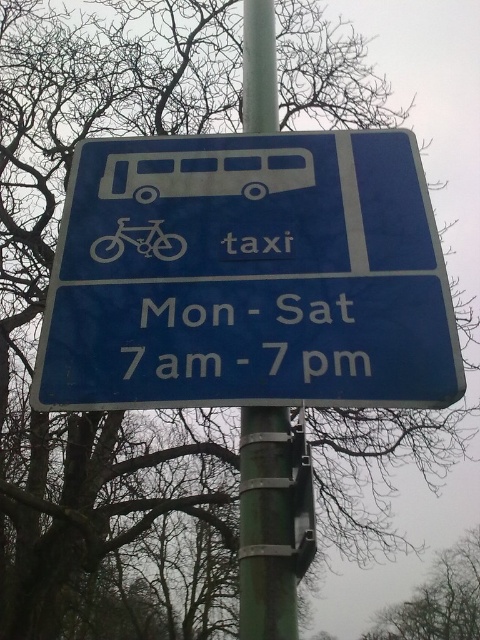
Question: Is blue plastic sign at center in front of white text at center?

Choices:
 (A) no
 (B) yes

Answer: (B)

Question: Among these points, which one is nearest to the camera?

Choices:
 (A) (126, 243)
 (B) (368, 360)

Answer: (B)

Question: Which object is closer to the camera taking this photo?

Choices:
 (A) green metallic pole at center
 (B) blue plastic sign at center
 (C) white text at center
 (D) matte silver bicycle at center

Answer: (B)

Question: Which point is closer to the camera?

Choices:
 (A) (187, 308)
 (B) (263, 557)

Answer: (B)

Question: Can you confirm if white text at center is bigger than matte silver bicycle at center?

Choices:
 (A) no
 (B) yes

Answer: (B)

Question: From the image, what is the correct spatial relationship of green metallic pole at center in relation to white text at center?

Choices:
 (A) left
 (B) right

Answer: (B)